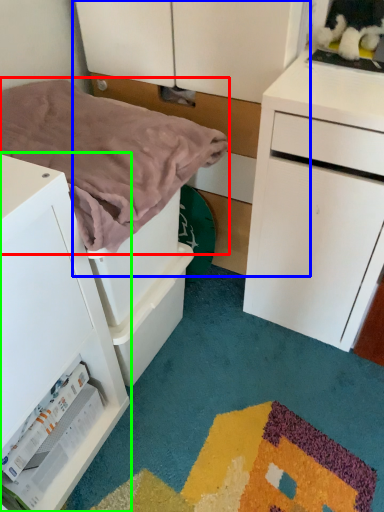
Question: Considering the real-world distances, which object is farthest from blanket (highlighted by a red box)? dresser (highlighted by a blue box) or chest of drawers (highlighted by a green box)?

Choices:
 (A) dresser
 (B) chest of drawers

Answer: (A)